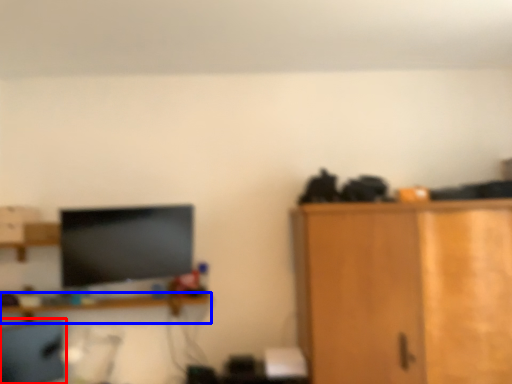
Question: Which object appears farthest to the camera in this image, computer chair (highlighted by a red box) or shelf (highlighted by a blue box)?

Choices:
 (A) computer chair
 (B) shelf

Answer: (B)